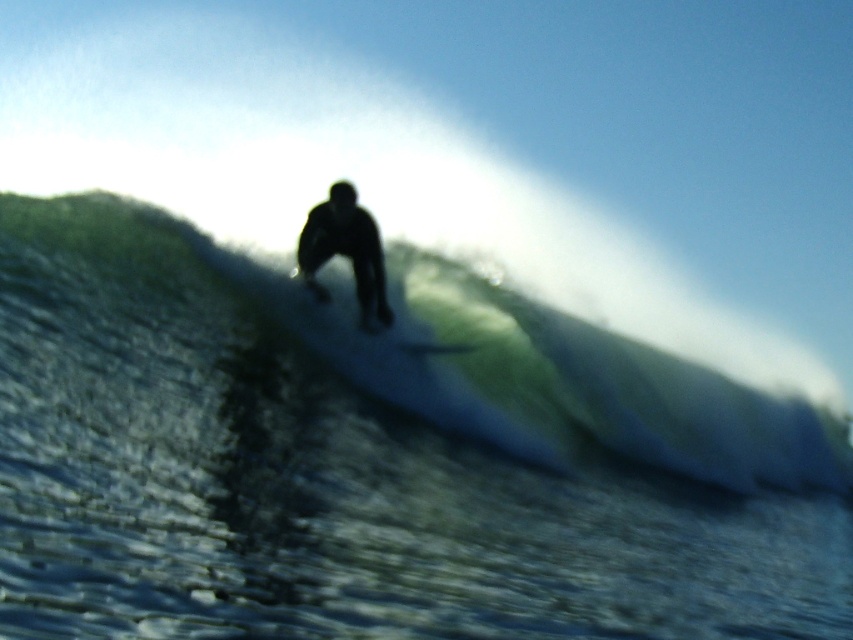
Can you confirm if green rubber surfboard at center is taller than smooth white surfboard at center?

Indeed, green rubber surfboard at center has a greater height compared to smooth white surfboard at center.

Can you confirm if green rubber surfboard at center is positioned above smooth white surfboard at center?

No, green rubber surfboard at center is not above smooth white surfboard at center.

Is point (67, 241) behind point (463, 346)?

No.

At what (x,y) coordinates should I click in order to perform the action: click on green rubber surfboard at center. Please return your answer as a coordinate pair (x, y). This screenshot has width=853, height=640. Looking at the image, I should click on (483, 358).

Between black matte surfboard at center and smooth white surfboard at center, which one has more height?

black matte surfboard at center is taller.

Does black matte surfboard at center have a greater height compared to smooth white surfboard at center?

Correct, black matte surfboard at center is much taller as smooth white surfboard at center.

At what (x,y) coordinates should I click in order to perform the action: click on black matte surfboard at center. Please return your answer as a coordinate pair (x, y). Image resolution: width=853 pixels, height=640 pixels. Looking at the image, I should click on (346, 252).

Is green rubber surfboard at center taller than black matte surfboard at center?

Yes, green rubber surfboard at center is taller than black matte surfboard at center.

Is green rubber surfboard at center to the left of black matte surfboard at center from the viewer's perspective?

No, green rubber surfboard at center is not to the left of black matte surfboard at center.

The height and width of the screenshot is (640, 853). Describe the element at coordinates (483, 358) in the screenshot. I see `green rubber surfboard at center` at that location.

Where is `green rubber surfboard at center`? The width and height of the screenshot is (853, 640). green rubber surfboard at center is located at coordinates (483, 358).